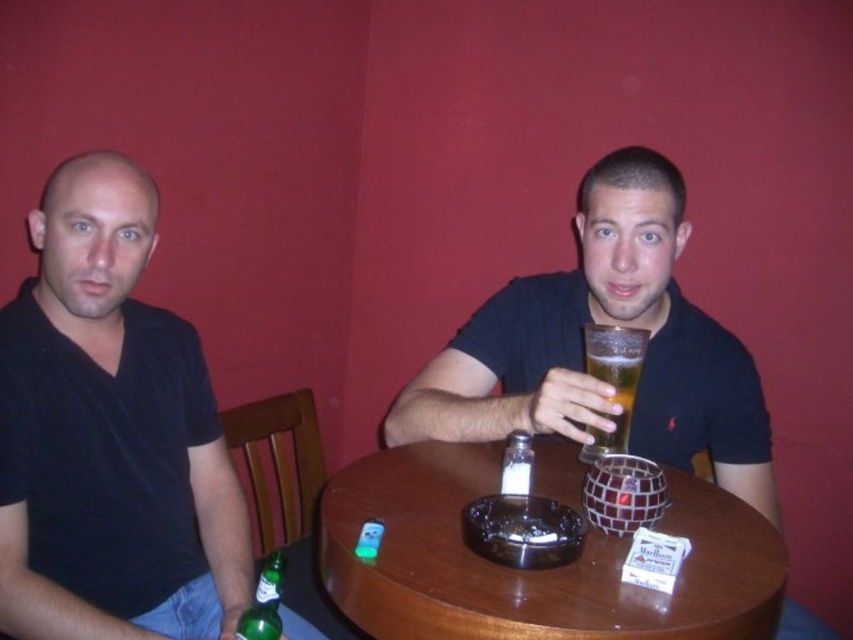
Question: Can you confirm if matte black shirt at center is wider than green glass bottle at lower left?

Choices:
 (A) yes
 (B) no

Answer: (A)

Question: Which object appears closest to the camera in this image?

Choices:
 (A) black matte shirt at left
 (B) matte black shirt at center
 (C) green glass bottle at lower left

Answer: (C)

Question: Where is matte black shirt at center located in relation to wooden round table at center in the image?

Choices:
 (A) right
 (B) left

Answer: (A)

Question: Does black matte shirt at left have a smaller size compared to matte black shirt at center?

Choices:
 (A) yes
 (B) no

Answer: (A)

Question: Which object is closer to the camera taking this photo?

Choices:
 (A) black matte shirt at left
 (B) green glass bottle at lower left

Answer: (B)

Question: Based on their relative distances, which object is farther from the matte black shirt at center?

Choices:
 (A) clear glass salt shaker at center
 (B) black matte shirt at left
 (C) green glass bottle at lower left
 (D) wooden round table at center

Answer: (C)